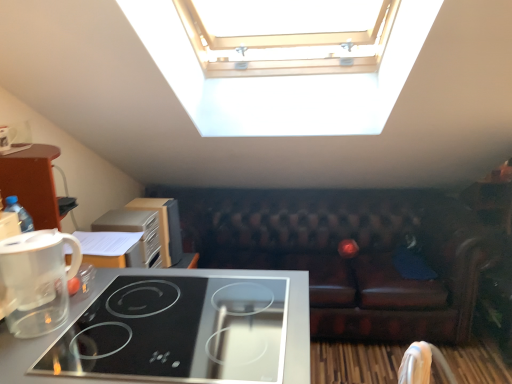
Question: Considering the relative positions of white fabric armchair at lower right and black glass cooktop at lower left in the image provided, is white fabric armchair at lower right in front of black glass cooktop at lower left?

Choices:
 (A) yes
 (B) no

Answer: (B)

Question: Considering the relative positions of white fabric armchair at lower right and black glass cooktop at lower left in the image provided, is white fabric armchair at lower right behind black glass cooktop at lower left?

Choices:
 (A) yes
 (B) no

Answer: (A)

Question: Considering the relative positions of white fabric armchair at lower right and black glass cooktop at lower left in the image provided, is white fabric armchair at lower right to the right of black glass cooktop at lower left from the viewer's perspective?

Choices:
 (A) yes
 (B) no

Answer: (A)

Question: Does white fabric armchair at lower right turn towards black glass cooktop at lower left?

Choices:
 (A) yes
 (B) no

Answer: (B)

Question: Considering the relative sizes of white fabric armchair at lower right and black glass cooktop at lower left in the image provided, is white fabric armchair at lower right thinner than black glass cooktop at lower left?

Choices:
 (A) yes
 (B) no

Answer: (A)

Question: In terms of width, does black glass cooktop at lower left look wider or thinner when compared to brown leather couch at center?

Choices:
 (A) wide
 (B) thin

Answer: (B)

Question: Is black glass cooktop at lower left in front of or behind brown leather couch at center in the image?

Choices:
 (A) front
 (B) behind

Answer: (A)

Question: From a real-world perspective, is black glass cooktop at lower left positioned above or below brown leather couch at center?

Choices:
 (A) above
 (B) below

Answer: (A)

Question: Considering the positions of black glass cooktop at lower left and brown leather couch at center in the image, is black glass cooktop at lower left taller or shorter than brown leather couch at center?

Choices:
 (A) short
 (B) tall

Answer: (A)

Question: Based on their positions, is wooden cabinet at left, the 2th appliance positioned from the front, located to the left or right of transparent plastic coffee maker at lower left?

Choices:
 (A) left
 (B) right

Answer: (B)

Question: Considering their positions, is wooden cabinet at left, the 2th appliance positioned from the front, located in front of or behind transparent plastic coffee maker at lower left?

Choices:
 (A) front
 (B) behind

Answer: (B)

Question: From the image's perspective, is wooden cabinet at left, the 2th appliance positioned from the front, located above or below transparent plastic coffee maker at lower left?

Choices:
 (A) above
 (B) below

Answer: (A)

Question: Does point tap(155, 200) appear closer or farther from the camera than point tap(11, 246)?

Choices:
 (A) farther
 (B) closer

Answer: (A)

Question: Looking at their shapes, would you say black glass cooktop at lower left is wider or thinner than white fabric armchair at lower right?

Choices:
 (A) wide
 (B) thin

Answer: (A)

Question: Considering the relative positions of black glass cooktop at lower left and white fabric armchair at lower right in the image provided, is black glass cooktop at lower left to the left or to the right of white fabric armchair at lower right?

Choices:
 (A) left
 (B) right

Answer: (A)